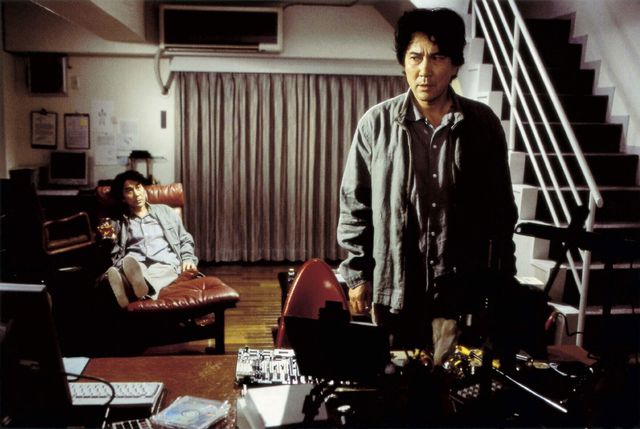
Where is `stairs`? The image size is (640, 429). stairs is located at coordinates (573, 167).